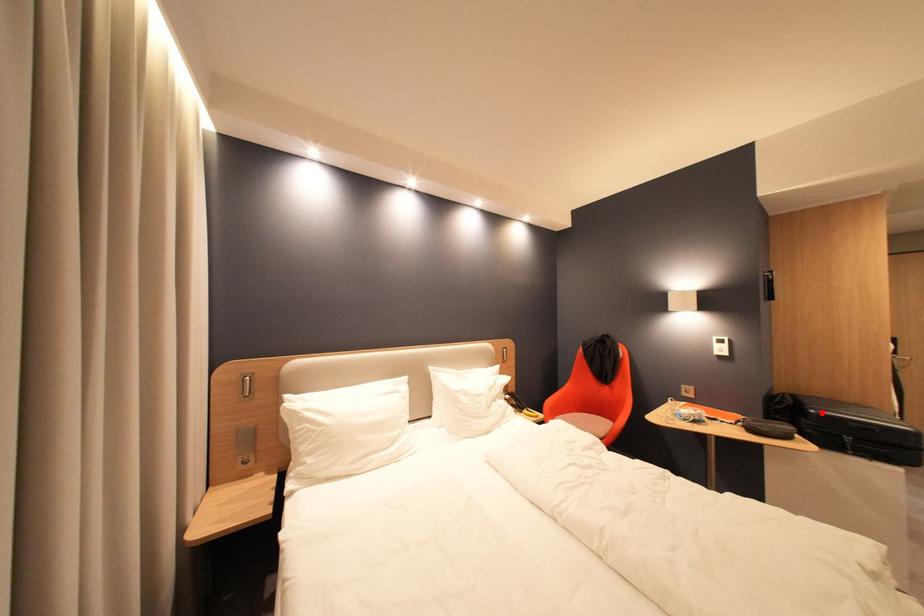
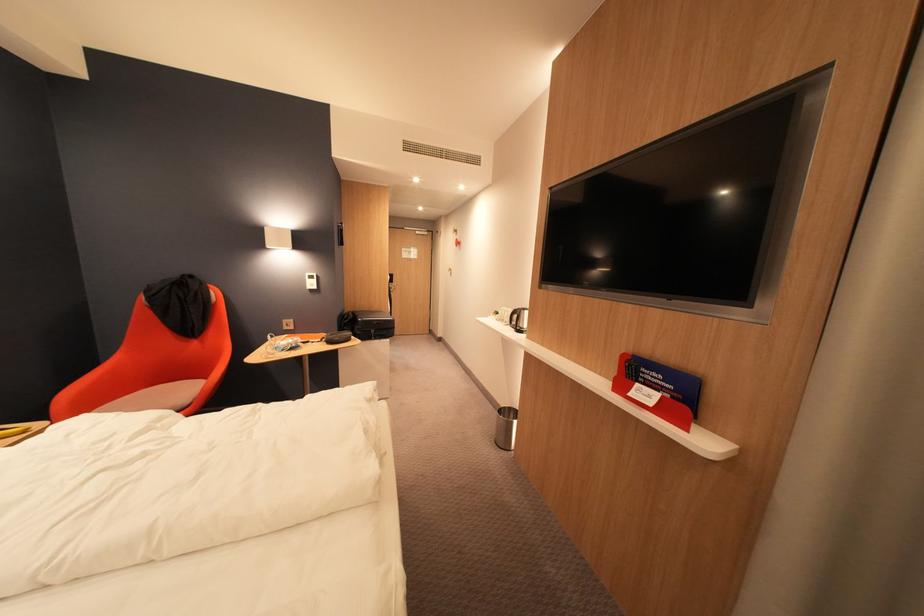
Find the pixel in the second image that matches the highlighted location in the first image.

(370, 321)